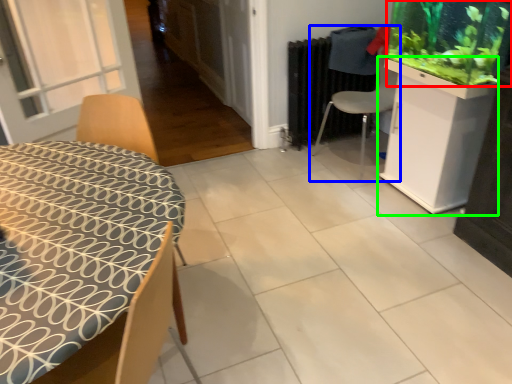
Question: Estimate the real-world distances between objects in this image. Which object is closer to plant (highlighted by a red box), chair (highlighted by a blue box) or cabinetry (highlighted by a green box)?

Choices:
 (A) chair
 (B) cabinetry

Answer: (B)